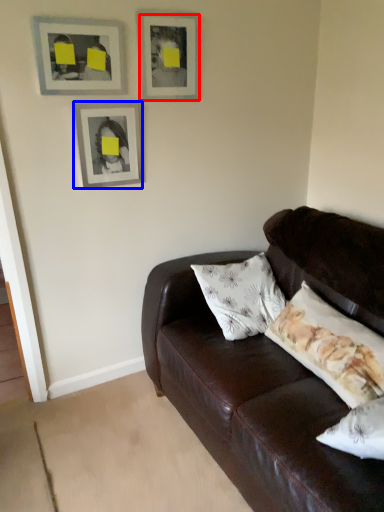
Question: Which object is closer to the camera taking this photo, picture frame (highlighted by a red box) or picture frame (highlighted by a blue box)?

Choices:
 (A) picture frame
 (B) picture frame

Answer: (A)